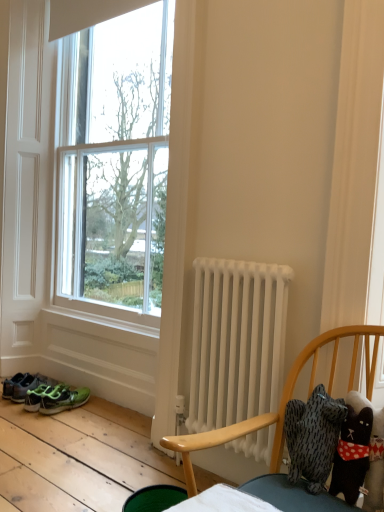
Question: Should I look upward or downward to see soft plush cat at right?

Choices:
 (A) up
 (B) down

Answer: (B)

Question: Can you confirm if white fabric curtain at right is wider than green matte sneakers at lower left, the first footwear viewed from the right?

Choices:
 (A) no
 (B) yes

Answer: (A)

Question: Is white fabric curtain at right turned away from green matte sneakers at lower left, arranged as the second footwear when viewed from the left?

Choices:
 (A) no
 (B) yes

Answer: (A)

Question: From a real-world perspective, is white fabric curtain at right below green matte sneakers at lower left, arranged as the second footwear when viewed from the left?

Choices:
 (A) yes
 (B) no

Answer: (B)

Question: Is white fabric curtain at right aimed at green matte sneakers at lower left, arranged as the second footwear when viewed from the left?

Choices:
 (A) yes
 (B) no

Answer: (B)

Question: Is white fabric curtain at right next to green matte sneakers at lower left, the first footwear viewed from the right, and touching it?

Choices:
 (A) yes
 (B) no

Answer: (B)

Question: Considering the relative positions of white fabric curtain at right and green matte sneakers at lower left, the first footwear viewed from the right, in the image provided, is white fabric curtain at right behind green matte sneakers at lower left, the first footwear viewed from the right,?

Choices:
 (A) no
 (B) yes

Answer: (A)

Question: Considering the relative positions of white fabric curtain at right and soft plush cat at right in the image provided, is white fabric curtain at right behind soft plush cat at right?

Choices:
 (A) yes
 (B) no

Answer: (A)

Question: Is the position of white fabric curtain at right less distant than that of soft plush cat at right?

Choices:
 (A) yes
 (B) no

Answer: (B)

Question: Does white fabric curtain at right have a greater height compared to soft plush cat at right?

Choices:
 (A) no
 (B) yes

Answer: (B)

Question: Does white fabric curtain at right have a greater width compared to soft plush cat at right?

Choices:
 (A) yes
 (B) no

Answer: (B)

Question: From the image's perspective, would you say white fabric curtain at right is positioned over soft plush cat at right?

Choices:
 (A) yes
 (B) no

Answer: (A)

Question: Is white fabric curtain at right oriented towards soft plush cat at right?

Choices:
 (A) no
 (B) yes

Answer: (B)

Question: From the image's perspective, is white fabric curtain at right under white matte radiator at center?

Choices:
 (A) no
 (B) yes

Answer: (A)